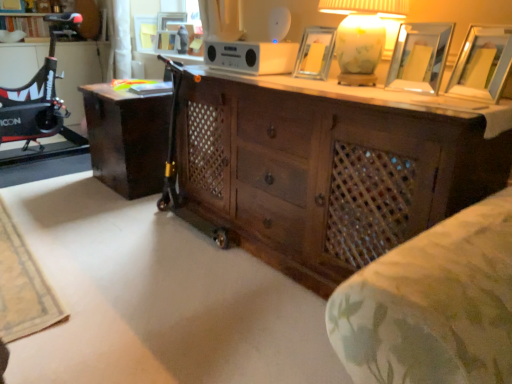
In order to click on free space in front of matte glass table lamp at upper right in this screenshot , I will do `click(369, 95)`.